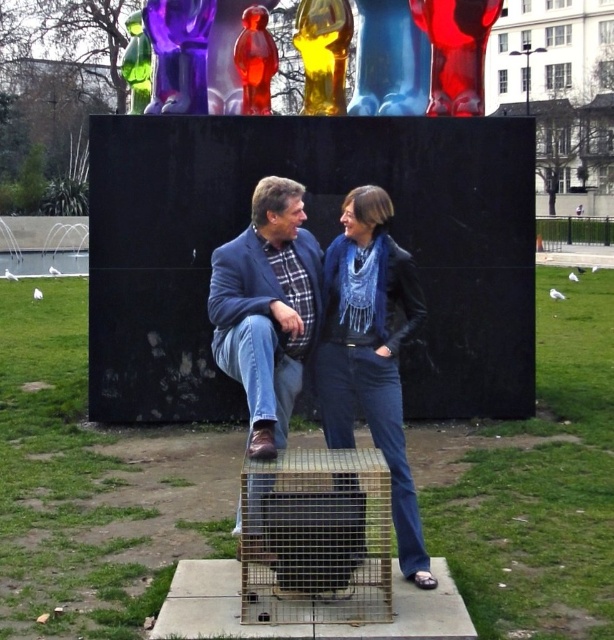
Does blue denim scarf at center lie behind matte blue jacket at center?

Yes, blue denim scarf at center is behind matte blue jacket at center.

What do you see at coordinates (370, 353) in the screenshot? This screenshot has width=614, height=640. I see `blue denim scarf at center` at bounding box center [370, 353].

The image size is (614, 640). I want to click on blue denim scarf at center, so click(370, 353).